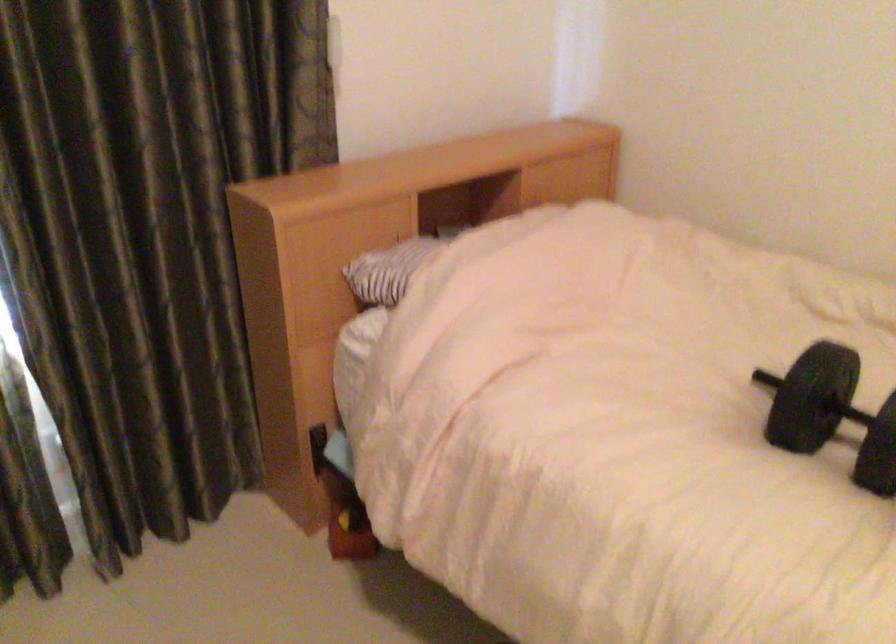
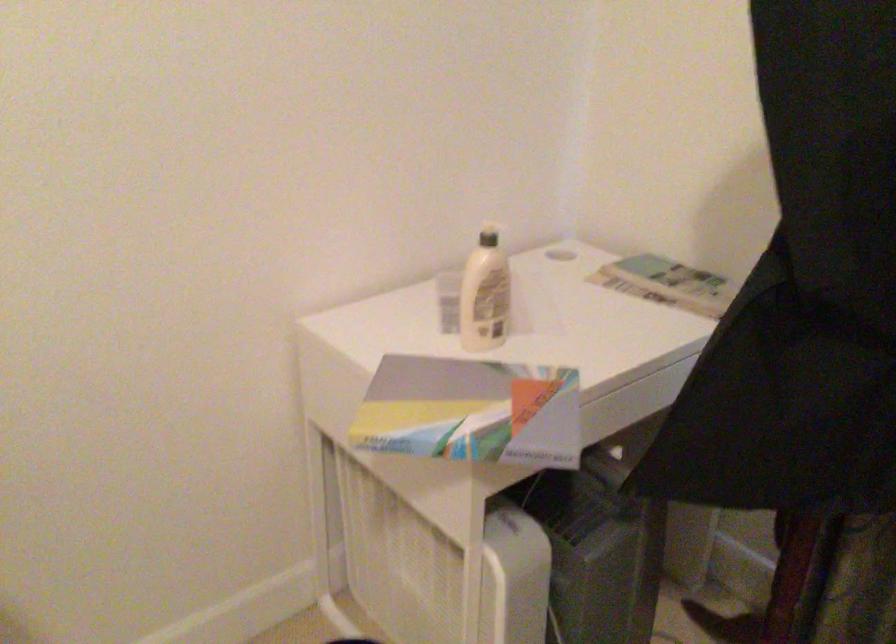
The images are taken continuously from a first-person perspective. In which direction is your viewpoint rotating?

The camera rotated toward left-down.